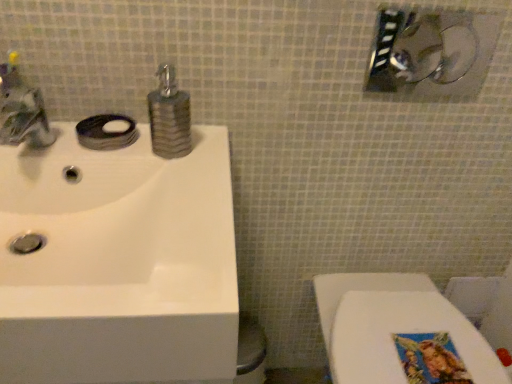
Question: Is white glossy toilet at lower right taller than brushed metal faucet at upper left?

Choices:
 (A) no
 (B) yes

Answer: (B)

Question: From the image's perspective, is white glossy toilet at lower right beneath brushed metal faucet at upper left?

Choices:
 (A) no
 (B) yes

Answer: (B)

Question: Is white glossy toilet at lower right bigger than brushed metal faucet at upper left?

Choices:
 (A) yes
 (B) no

Answer: (A)

Question: Is white glossy toilet at lower right turned away from brushed metal faucet at upper left?

Choices:
 (A) yes
 (B) no

Answer: (B)

Question: Is white glossy toilet at lower right outside of brushed metal faucet at upper left?

Choices:
 (A) no
 (B) yes

Answer: (B)

Question: Is white glossy toilet at lower right smaller than brushed metal faucet at upper left?

Choices:
 (A) yes
 (B) no

Answer: (B)

Question: Is textured brown soap dispenser at center beside brushed metal showerhead at upper right?

Choices:
 (A) yes
 (B) no

Answer: (B)

Question: From the image's perspective, is textured brown soap dispenser at center located beneath brushed metal showerhead at upper right?

Choices:
 (A) no
 (B) yes

Answer: (B)

Question: Can you confirm if textured brown soap dispenser at center is taller than brushed metal showerhead at upper right?

Choices:
 (A) yes
 (B) no

Answer: (A)

Question: Can you confirm if textured brown soap dispenser at center is smaller than brushed metal showerhead at upper right?

Choices:
 (A) no
 (B) yes

Answer: (B)

Question: Can you confirm if textured brown soap dispenser at center is positioned to the right of brushed metal showerhead at upper right?

Choices:
 (A) no
 (B) yes

Answer: (A)

Question: From a real-world perspective, is textured brown soap dispenser at center under brushed metal showerhead at upper right?

Choices:
 (A) yes
 (B) no

Answer: (A)

Question: From the image's perspective, is brushed metal faucet at upper left beneath brushed metal showerhead at upper right?

Choices:
 (A) no
 (B) yes

Answer: (B)